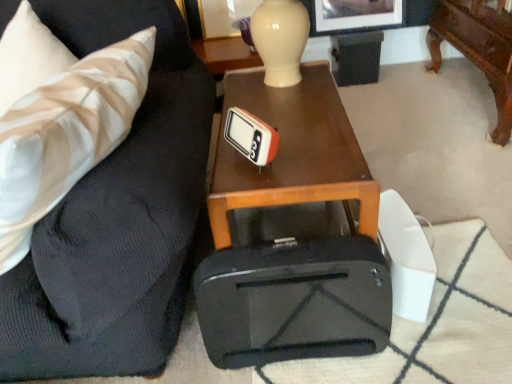
This screenshot has width=512, height=384. Identify the location of free space to the back side of white plastic thermometer at center. (271, 126).